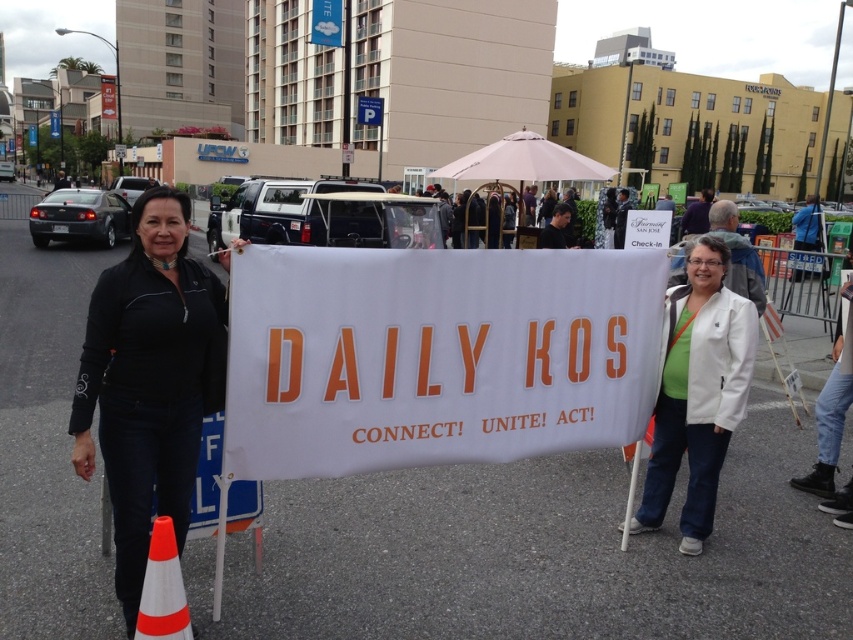
Question: Among these objects, which one is farthest from the camera?

Choices:
 (A) white matte jacket at center
 (B) white paper banner at center
 (C) orange and white plastic traffic cone at lower left

Answer: (A)

Question: Which point is farther from the camera taking this photo?

Choices:
 (A) (180, 632)
 (B) (291, 342)

Answer: (B)

Question: Does white matte jacket at center have a larger size compared to orange and white plastic traffic cone at lower left?

Choices:
 (A) yes
 (B) no

Answer: (A)

Question: Estimate the real-world distances between objects in this image. Which object is closer to the black fabric at center?

Choices:
 (A) white paper banner at center
 (B) white matte jacket at center
 (C) orange and white plastic traffic cone at lower left

Answer: (C)

Question: Is white paper banner at center wider than black fabric at center?

Choices:
 (A) yes
 (B) no

Answer: (A)

Question: Does black fabric at center have a larger size compared to white matte jacket at center?

Choices:
 (A) no
 (B) yes

Answer: (B)